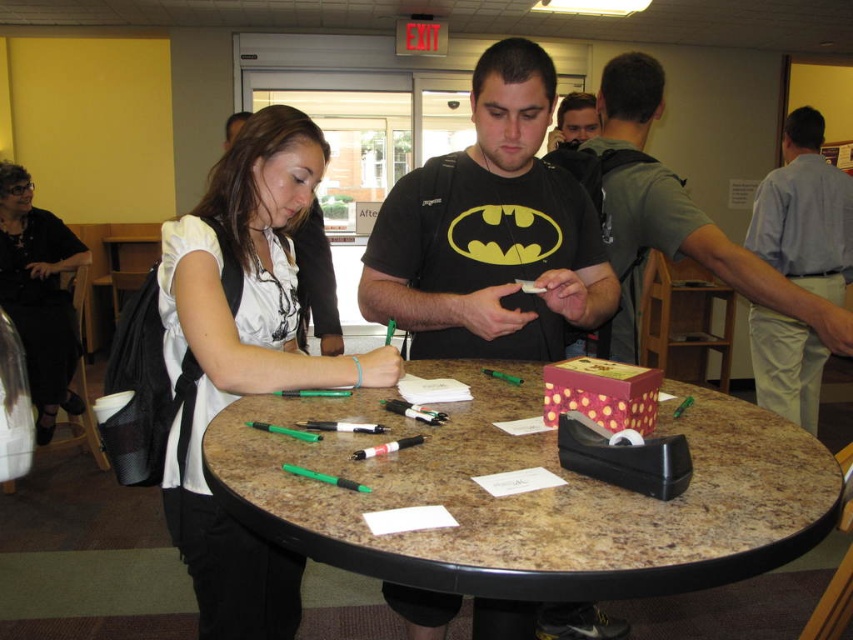
Question: Does black fabric dress at upper left have a greater width compared to matte black shirt at center?

Choices:
 (A) no
 (B) yes

Answer: (B)

Question: Estimate the real-world distances between objects in this image. Which object is farther from the brown marble table at center?

Choices:
 (A) light blue shirt at right
 (B) white matte shirt at center
 (C) black matte t-shirt at center
 (D) matte black shirt at center

Answer: (A)

Question: Does black matte t-shirt at center have a smaller size compared to black fabric dress at upper left?

Choices:
 (A) no
 (B) yes

Answer: (B)

Question: Which object appears farthest from the camera in this image?

Choices:
 (A) black fabric dress at upper left
 (B) matte black shirt at center
 (C) black matte t-shirt at center

Answer: (A)

Question: Does green matte pen at center appear under black fabric dress at upper left?

Choices:
 (A) no
 (B) yes

Answer: (A)

Question: Which object is the farthest from the white matte shirt at center?

Choices:
 (A) black matte t-shirt at center
 (B) brown marble table at center
 (C) green matte pen at center
 (D) light blue shirt at right

Answer: (D)